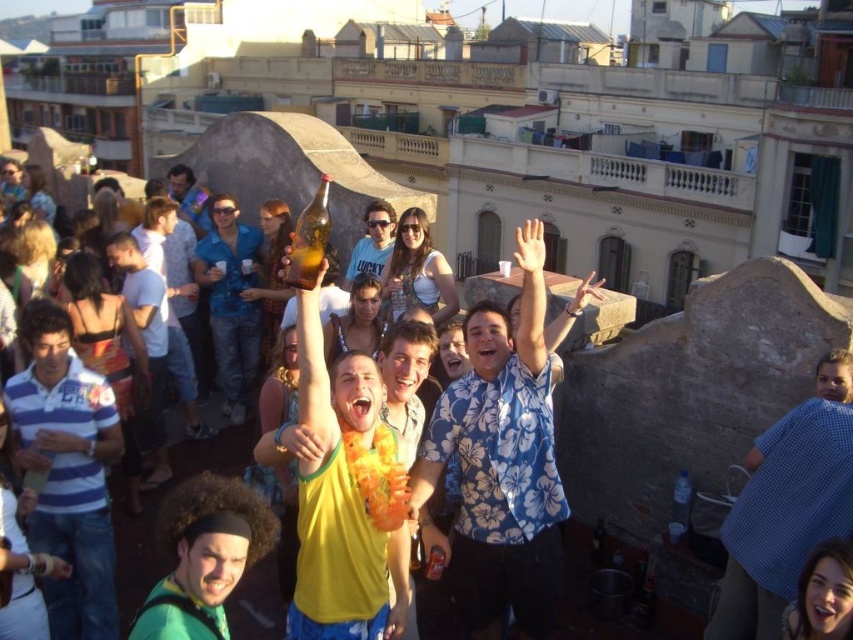
Locate an element on the screen. The width and height of the screenshot is (853, 640). blue checkered shirt at lower right is located at coordinates (786, 506).

Does blue checkered shirt at lower right have a lesser width compared to smooth skin face at center?

Correct, blue checkered shirt at lower right's width is less than smooth skin face at center's.

The width and height of the screenshot is (853, 640). What do you see at coordinates (786, 506) in the screenshot?
I see `blue checkered shirt at lower right` at bounding box center [786, 506].

Find the location of a particular element. blue checkered shirt at lower right is located at coordinates (786, 506).